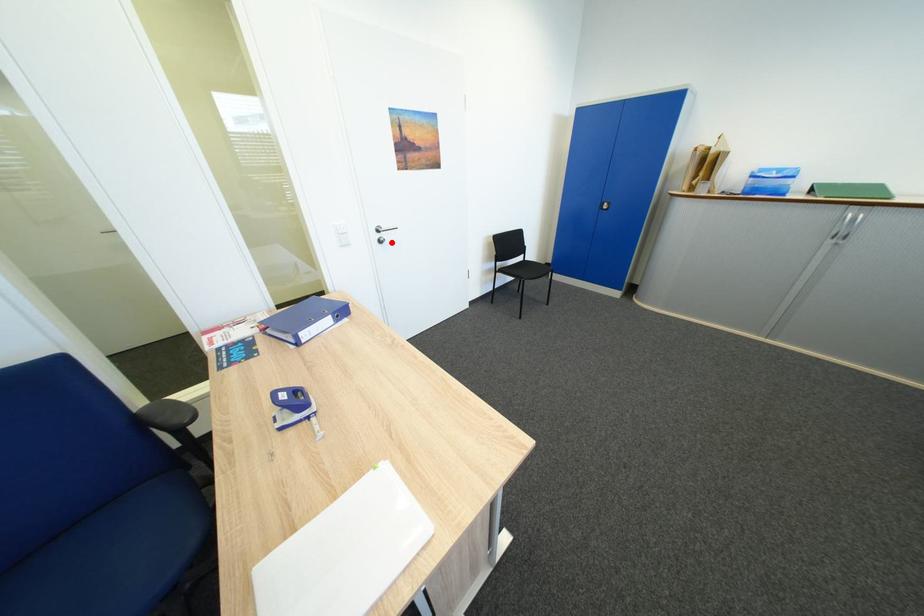
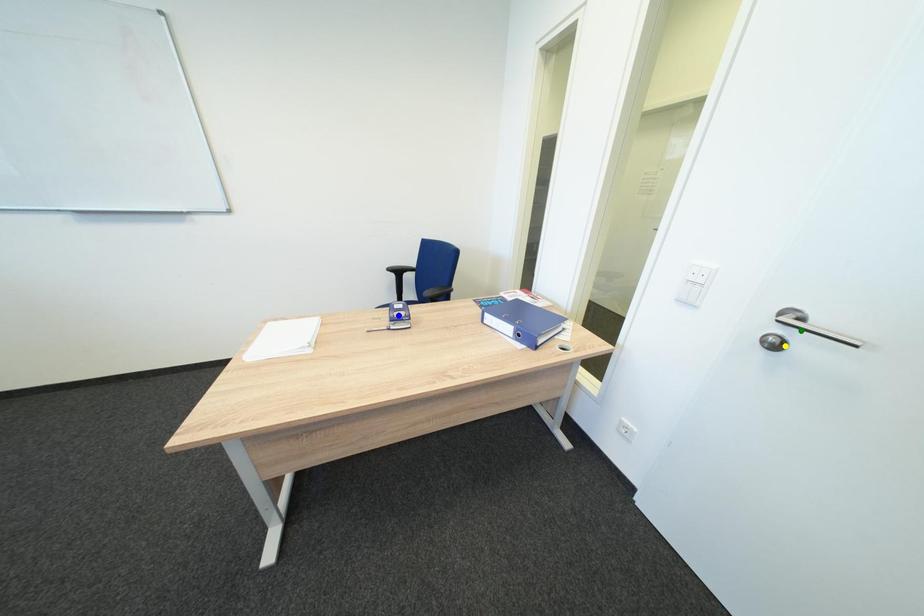
Question: I am providing you with two images of the same scene from different viewpoints. A red point is marked on the first image. You are given multiple points on the second image. Which spot in image 2 lines up with the point in image 1?

Choices:
 (A) yellow point
 (B) green point
 (C) blue point

Answer: (A)